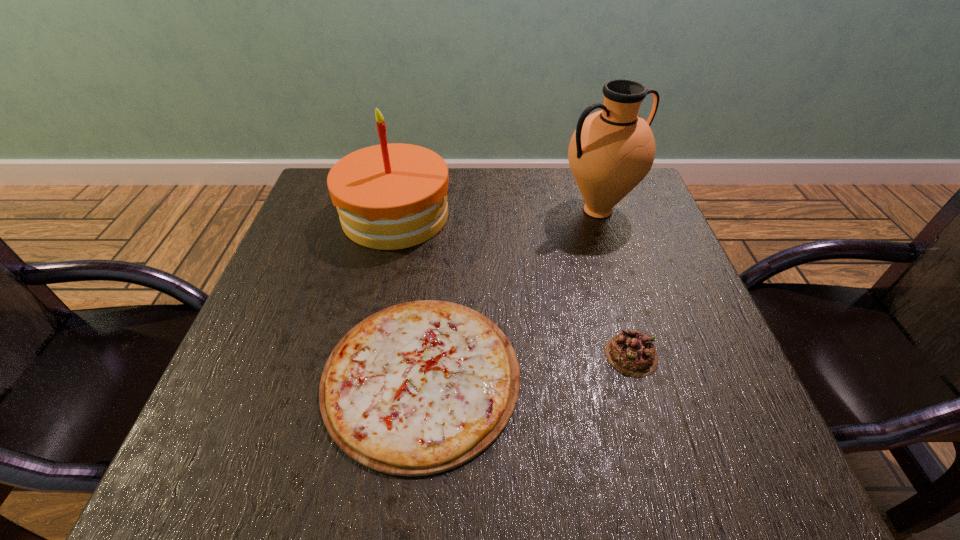
I want to click on object situated at the near edge, so coord(418,388).

Locate an element on the screen. The height and width of the screenshot is (540, 960). object that is at the left edge is located at coordinates (393, 196).

The image size is (960, 540). What are the coordinates of `pitcher at the right edge` in the screenshot? It's located at (611, 151).

The image size is (960, 540). In order to click on chocolate cake that is at the right edge in this screenshot , I will do `click(630, 352)`.

Identify the location of object at the far left corner. The height and width of the screenshot is (540, 960). (393, 196).

This screenshot has width=960, height=540. Find the location of `object located in the far right corner section of the desktop`. object located in the far right corner section of the desktop is located at coordinates (611, 151).

Locate an element on the screen. The width and height of the screenshot is (960, 540). free space at the far edge is located at coordinates (493, 214).

Find the location of a particular element. The height and width of the screenshot is (540, 960). vacant space at the near edge is located at coordinates (618, 476).

Identify the location of vacant area at the left edge of the desktop. (343, 241).

The image size is (960, 540). Find the location of `blank space at the right edge`. blank space at the right edge is located at coordinates click(620, 298).